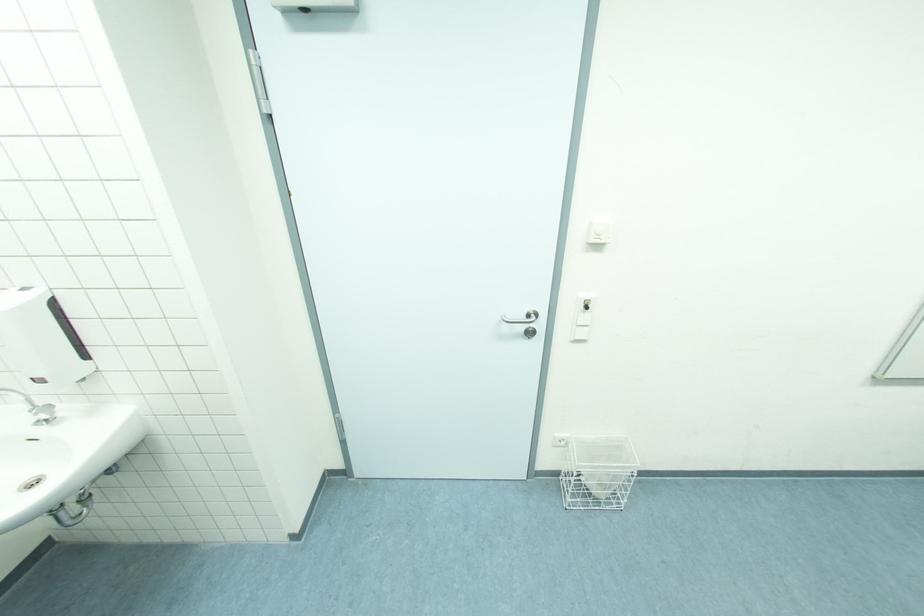
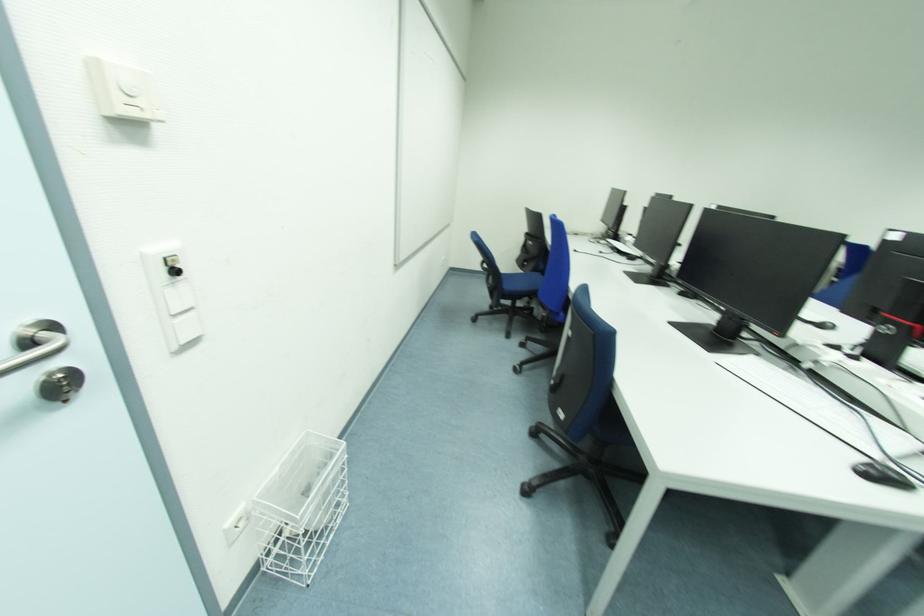
Find the pixel in the second image that matches point (563, 472) in the first image.

(261, 564)